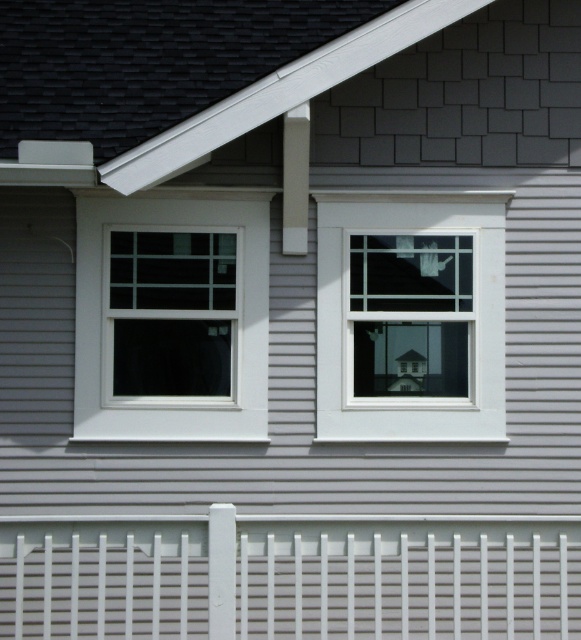
Is point (418, 634) behind point (400, 244)?

No, it is not.

Between white plastic fence at lower center and white glass window at center, which one has more height?

white glass window at center is taller.

Identify the location of white plastic fence at lower center. The height and width of the screenshot is (640, 581). (288, 579).

The height and width of the screenshot is (640, 581). Find the location of `white plastic fence at lower center`. white plastic fence at lower center is located at coordinates (288, 579).

Does point (525, 608) come closer to viewer compared to point (120, 426)?

Yes, point (525, 608) is in front of point (120, 426).

The height and width of the screenshot is (640, 581). Identify the location of white plastic fence at lower center. (288, 579).

Between white glass window at center and white matte window at left, which one has less height?

Standing shorter between the two is white matte window at left.

Is white glass window at center bigger than white matte window at left?

Indeed, white glass window at center has a larger size compared to white matte window at left.

The height and width of the screenshot is (640, 581). In order to click on white glass window at center in this screenshot , I will do `click(410, 316)`.

Find the location of a particular element. white glass window at center is located at coordinates (410, 316).